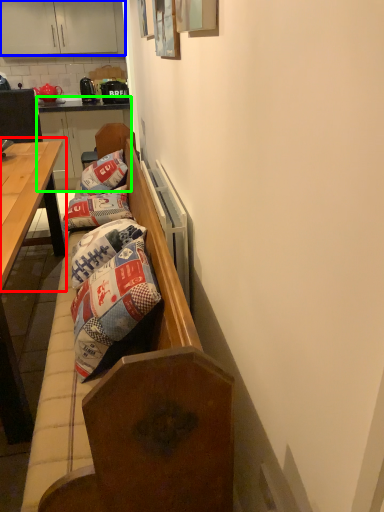
Question: Which object is the closest to the table (highlighted by a red box)? Choose among these: cabinetry (highlighted by a blue box) or dresser (highlighted by a green box).

Choices:
 (A) cabinetry
 (B) dresser

Answer: (B)